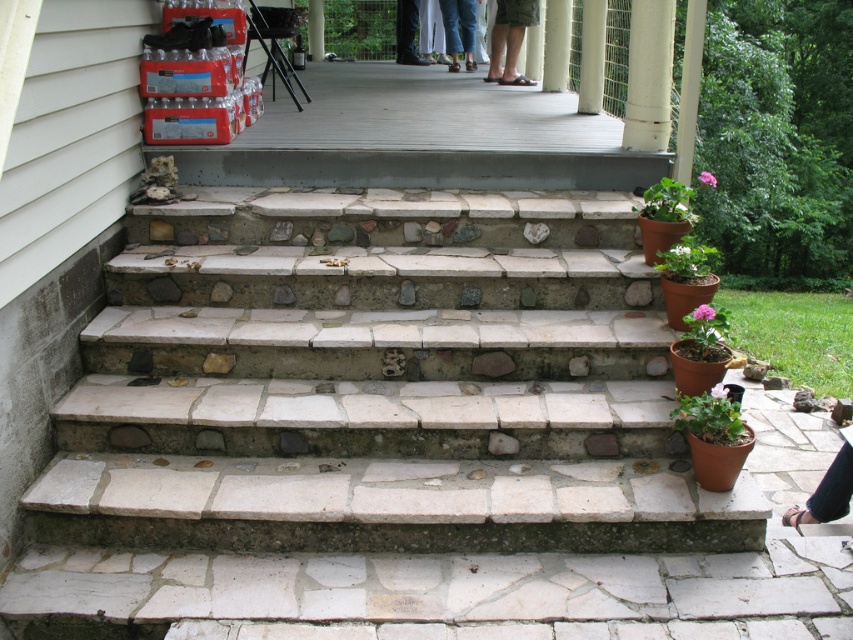
Between point (817, 484) and point (473, 42), which one is positioned behind?

The point (473, 42) is more distant.

Is black leather sandals at lower right thinner than blue jeans at upper center?

Yes.

Is point (781, 518) positioned before point (456, 65)?

Yes, point (781, 518) is in front of point (456, 65).

Identify the location of black leather sandals at lower right. (827, 490).

Based on the photo, how distant is natural stone stairs at center from green matte pot at lower right?

natural stone stairs at center and green matte pot at lower right are 4.11 meters apart.

Is natural stone stairs at center positioned before green matte pot at lower right?

Yes, natural stone stairs at center is closer to the viewer.

What do you see at coordinates (380, 381) in the screenshot? Image resolution: width=853 pixels, height=640 pixels. I see `natural stone stairs at center` at bounding box center [380, 381].

The width and height of the screenshot is (853, 640). Identify the location of natural stone stairs at center. (380, 381).

Does green matte pot at lower right appear on the left side of white stone pillar at center?

No, green matte pot at lower right is not to the left of white stone pillar at center.

Identify the location of green matte pot at lower right. (795, 333).